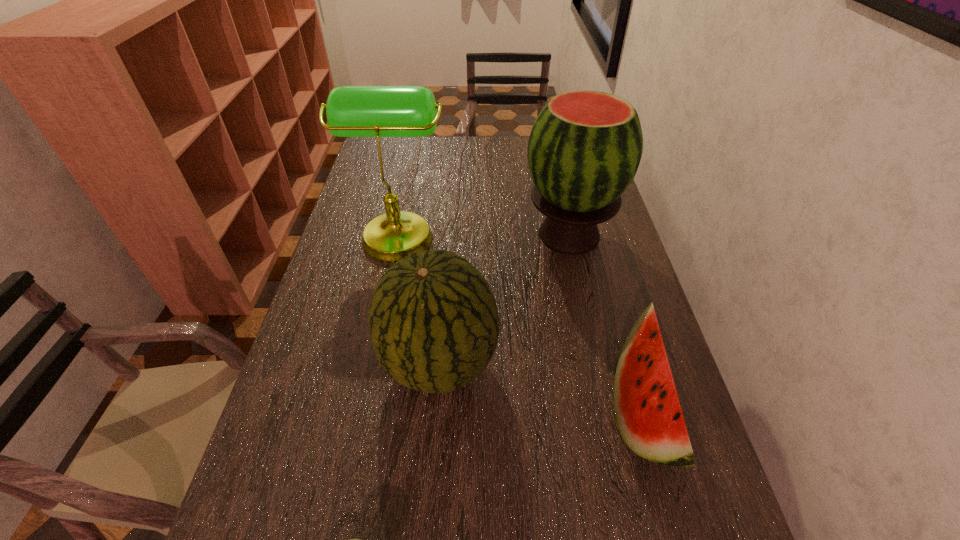
Identify the location of free space located on the outer rind of the shortest watermelon. (435, 411).

Find the location of a particular element. The width and height of the screenshot is (960, 540). object at the left edge is located at coordinates (352, 111).

Locate an element on the screen. vacant space at the far edge of the desktop is located at coordinates [x=520, y=142].

In the image, there is a desktop. At what (x,y) coordinates should I click in order to perform the action: click on free region at the left edge. Please return your answer as a coordinate pair (x, y). The width and height of the screenshot is (960, 540). Looking at the image, I should click on (309, 430).

The height and width of the screenshot is (540, 960). Identify the location of vacant space at the right edge. (610, 224).

Image resolution: width=960 pixels, height=540 pixels. Find the location of `free region at the far left corner of the desktop`. free region at the far left corner of the desktop is located at coordinates (375, 152).

The image size is (960, 540). Identify the location of free space between the shortest watermelon and the tallest watermelon. pyautogui.click(x=606, y=323).

This screenshot has height=540, width=960. What are the coordinates of `free space between the fourth tallest object and the leftmost watermelon` in the screenshot? It's located at (541, 388).

You are a GUI agent. You are given a task and a screenshot of the screen. Output one action in this format:
    pyautogui.click(x=<x>, y=<y>)
    Task: Click on the free spot between the second shortest object and the third shortest object
    This screenshot has height=540, width=960.
    Given the screenshot: What is the action you would take?
    pyautogui.click(x=541, y=388)

Where is `object that is the third closest to the shortest object`? The height and width of the screenshot is (540, 960). object that is the third closest to the shortest object is located at coordinates (352, 111).